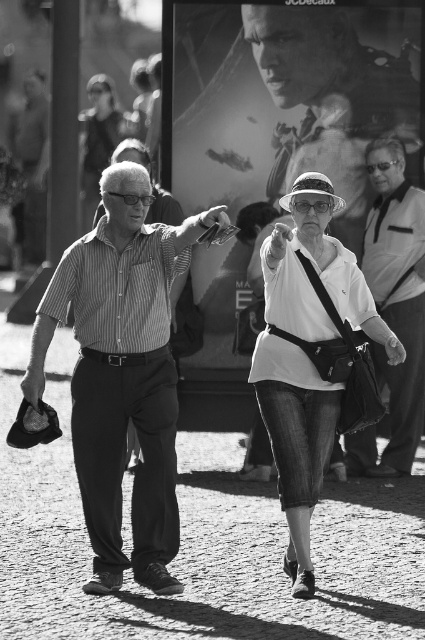
Is point (167, 305) less distant than point (384, 52)?

That is True.

Describe the element at coordinates (121, 372) in the screenshot. Image resolution: width=425 pixels, height=640 pixels. I see `striped cotton shirt at center` at that location.

Find the location of a particular element. striped cotton shirt at center is located at coordinates (121, 372).

Which is more to the left, denim jeans at center or white matte shirt at center?

white matte shirt at center

Is point (286, 355) less distant than point (311, 378)?

No, it is behind (311, 378).

Measure the distance between denim jeans at center and camera.

denim jeans at center is 7.66 meters from camera.

Identify the location of denim jeans at center. This screenshot has width=425, height=640. (306, 355).

Can you confirm if striped cotton shirt at center is positioned to the left of denim jeans at center?

Indeed, striped cotton shirt at center is positioned on the left side of denim jeans at center.

Does point (149, 349) come in front of point (295, 432)?

That is False.

Who is more forward, (87, 308) or (295, 468)?

Point (295, 468) is in front.

Locate an element on the screen. The width and height of the screenshot is (425, 640). striped cotton shirt at center is located at coordinates (121, 372).